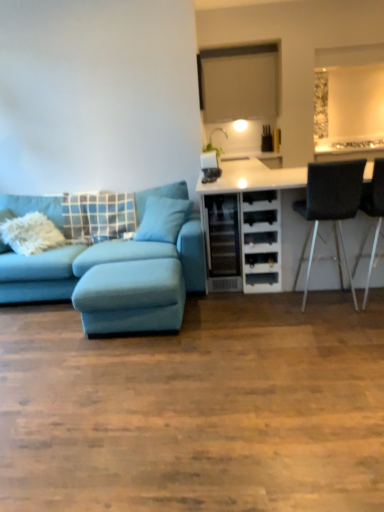
Find the location of `vacant space that is to the left of light blue fabric footrest at lower left`. vacant space that is to the left of light blue fabric footrest at lower left is located at coordinates (49, 338).